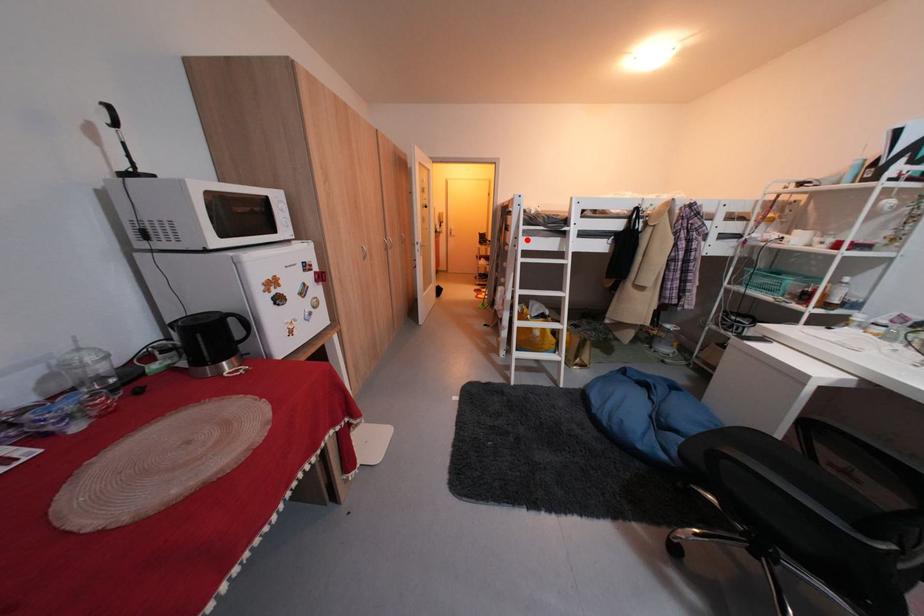
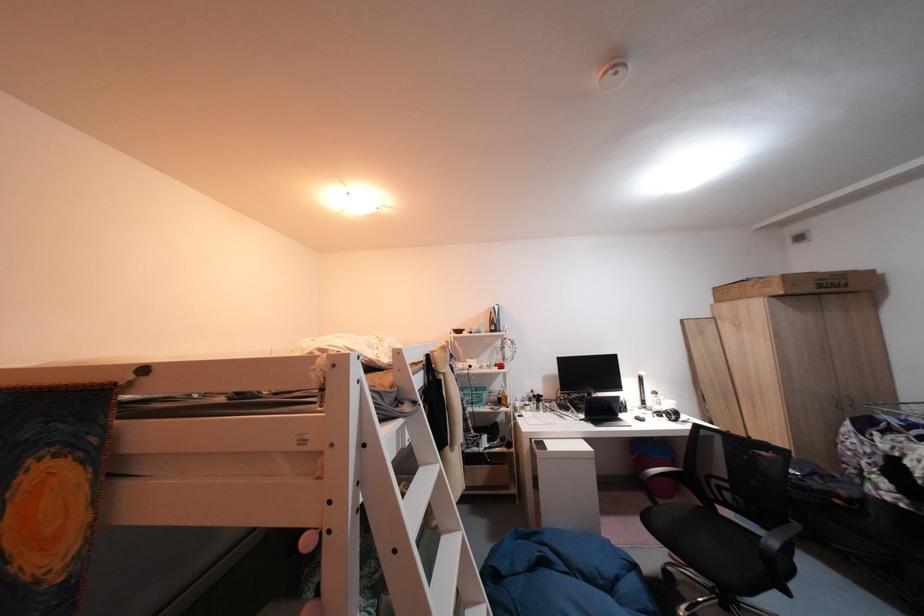
Locate, in the second image, the point that corresponds to the highlighted location in the first image.

(370, 485)